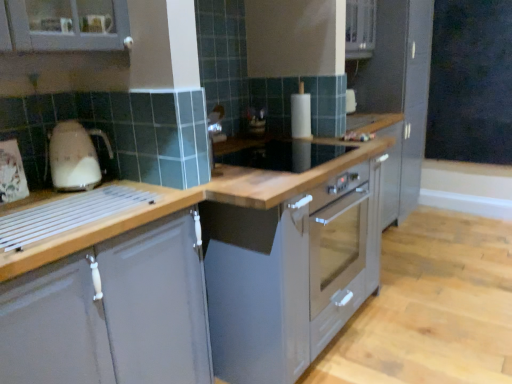
Question: From a real-world perspective, is satin grey cabinet at right, the 2th cabinetry in the front-to-back sequence, physically located above or below black matte chalkboard at upper right?

Choices:
 (A) above
 (B) below

Answer: (B)

Question: From their relative heights in the image, would you say satin grey cabinet at right, the 1th cabinetry in the top-to-bottom sequence, is taller or shorter than black matte chalkboard at upper right?

Choices:
 (A) short
 (B) tall

Answer: (B)

Question: Based on their relative distances, which object is farther from the matte gray cabinet at left, placed as the first cabinetry when sorted from front to back?

Choices:
 (A) satin grey cabinet at right, arranged as the 1th cabinetry when viewed from the back
 (B) black matte chalkboard at upper right
 (C) white paper towel holder at center
 (D) beige glossy kettle at left
 (E) satin silver oven at center

Answer: (B)

Question: Which object is the closest to the white paper towel holder at center?

Choices:
 (A) beige glossy kettle at left
 (B) black matte chalkboard at upper right
 (C) satin grey cabinet at right, which is the 2th cabinetry from left to right
 (D) satin silver oven at center
 (E) matte gray cabinet at left, which is the first cabinetry in left-to-right order

Answer: (D)